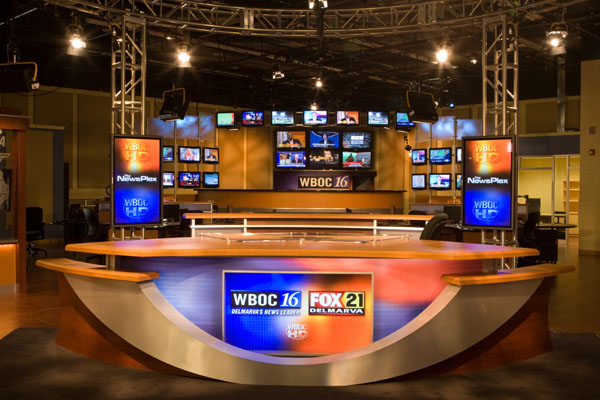
Locate an element on the screen. The image size is (600, 400). glass is located at coordinates (9, 214).